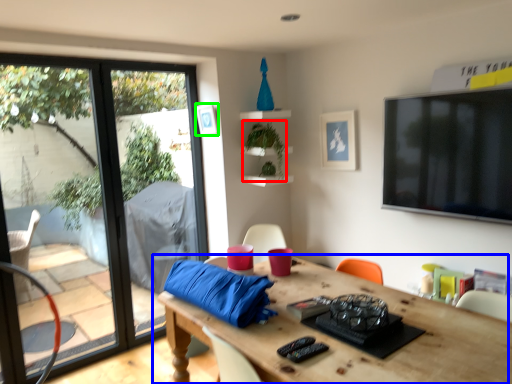
Question: Estimate the real-world distances between objects in this image. Which object is farther from plant (highlighted by a red box), table (highlighted by a blue box) or picture frame (highlighted by a green box)?

Choices:
 (A) table
 (B) picture frame

Answer: (A)